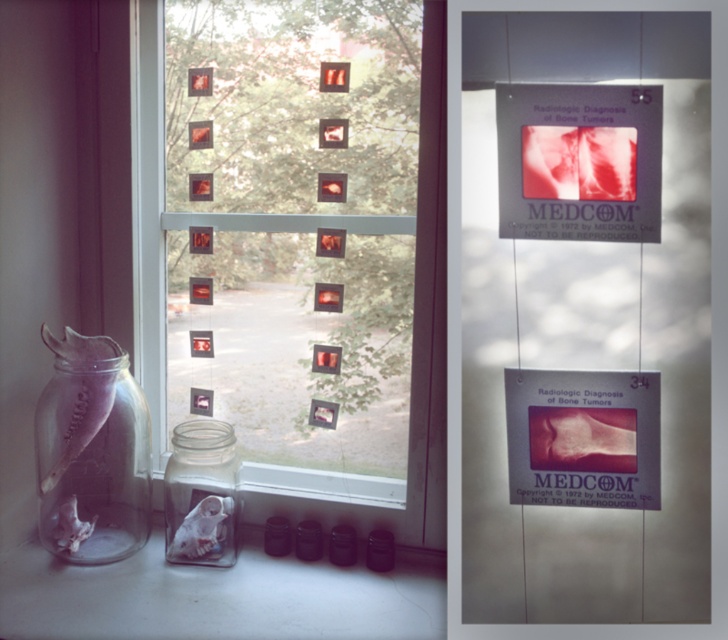
Which is more to the right, matte plastic poster at upper right or clear glass jar at left?

From the viewer's perspective, matte plastic poster at upper right appears more on the right side.

Can you confirm if matte plastic poster at upper right is positioned to the right of clear glass jar at left?

Indeed, matte plastic poster at upper right is positioned on the right side of clear glass jar at left.

This screenshot has height=640, width=728. Describe the element at coordinates (579, 161) in the screenshot. I see `matte plastic poster at upper right` at that location.

Where is `matte plastic poster at upper right`? This screenshot has height=640, width=728. matte plastic poster at upper right is located at coordinates (579, 161).

Describe the element at coordinates (680, 326) in the screenshot. The image size is (728, 640). I see `matte gray paper at center` at that location.

Is matte gray paper at center thinner than matte paper poster at center?

No.

Is point (577, 596) behind point (569, 493)?

Yes, point (577, 596) is behind point (569, 493).

The image size is (728, 640). I want to click on matte gray paper at center, so click(680, 326).

Does transparent glass window at center appear on the right side of clear glass jar at center?

In fact, transparent glass window at center is to the left of clear glass jar at center.

Does transparent glass window at center appear under clear glass jar at center?

No.

Which is in front, point (132, 253) or point (205, 472)?

Point (205, 472) is in front.

The height and width of the screenshot is (640, 728). I want to click on transparent glass window at center, so click(x=149, y=209).